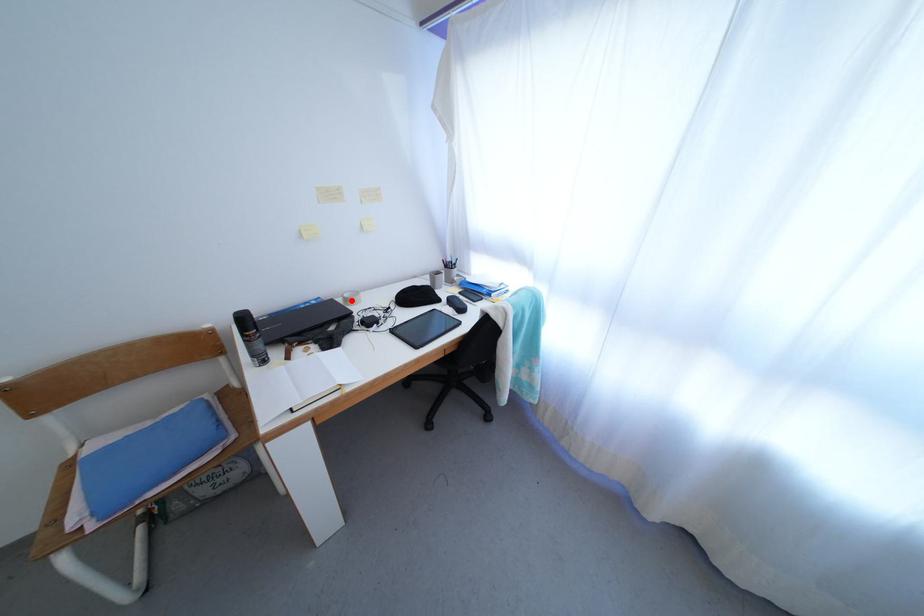
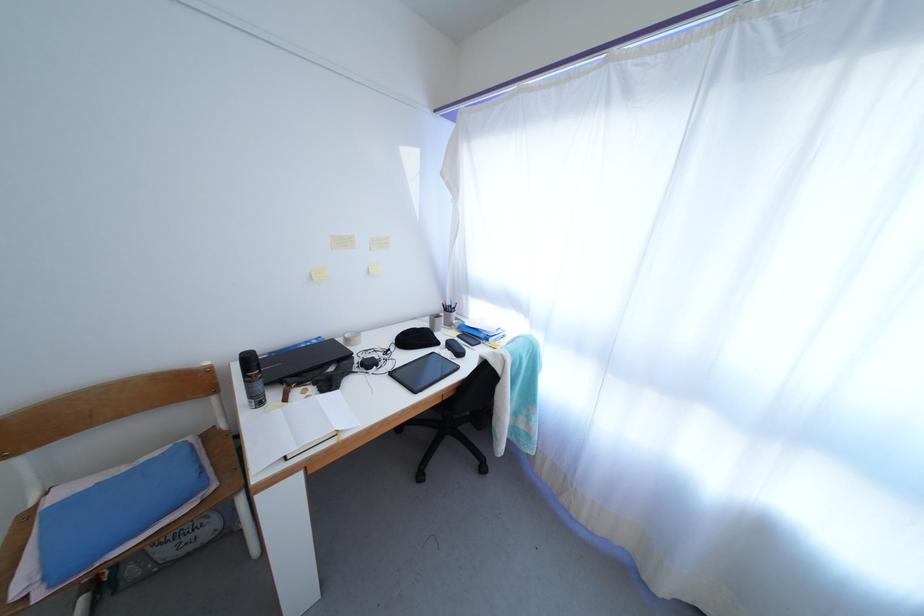
Find the pixel in the second image that matches the highlighted location in the first image.

(353, 341)